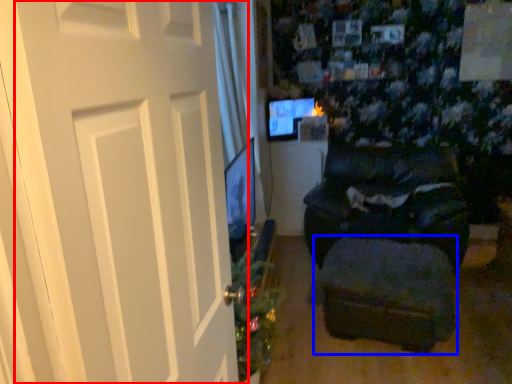
Question: Which point is further to the camera, door (highlighted by a red box) or footrest (highlighted by a blue box)?

Choices:
 (A) door
 (B) footrest

Answer: (B)